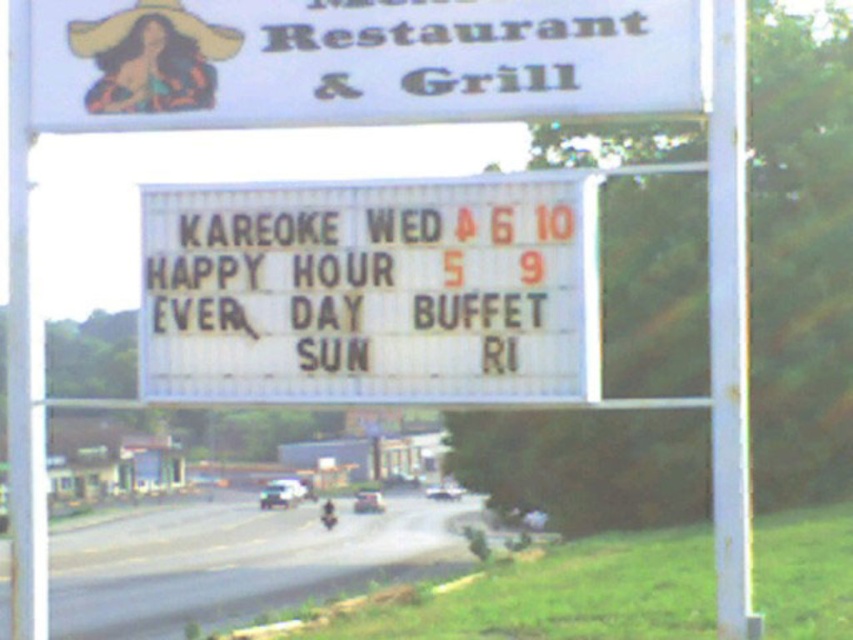
Question: Which object appears farthest from the camera in this image?

Choices:
 (A) metallic silver motorcycle at center
 (B) white plastic signboard at center
 (C) yellow fabric cowboy hat at upper left

Answer: (A)

Question: Which point is farther to the camera?

Choices:
 (A) (334, 509)
 (B) (250, 237)

Answer: (A)

Question: Observing the image, what is the correct spatial positioning of white plastic signboard at center in reference to metallic silver motorcycle at center?

Choices:
 (A) left
 (B) right

Answer: (B)

Question: Can you confirm if yellow fabric cowboy hat at upper left is smaller than metallic silver motorcycle at center?

Choices:
 (A) no
 (B) yes

Answer: (B)

Question: Is white plastic signboard at center bigger than yellow fabric cowboy hat at upper left?

Choices:
 (A) no
 (B) yes

Answer: (B)

Question: Which point is farther to the camera?

Choices:
 (A) white plastic signboard at center
 (B) yellow fabric cowboy hat at upper left

Answer: (B)